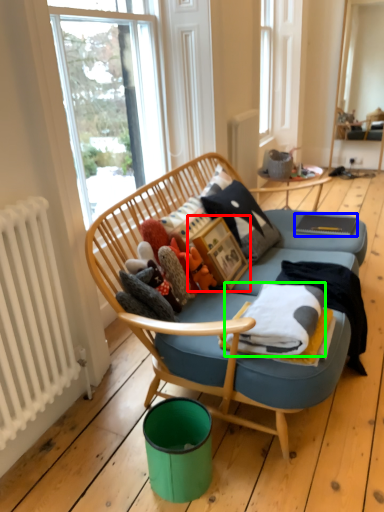
Question: Which is nearer to the picture frame (highlighted by a red box)? magazine (highlighted by a blue box) or blanket (highlighted by a green box).

Choices:
 (A) magazine
 (B) blanket

Answer: (B)